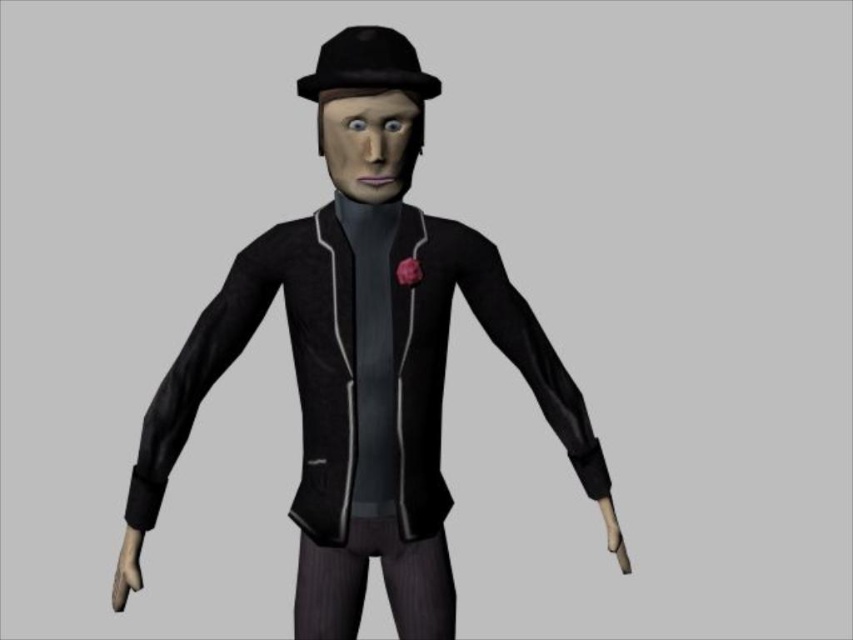
Where is the matte black jacket at center located in the image?

The matte black jacket at center is located at point 0.589 in the x coordinate and 0.427 in the y coordinate.